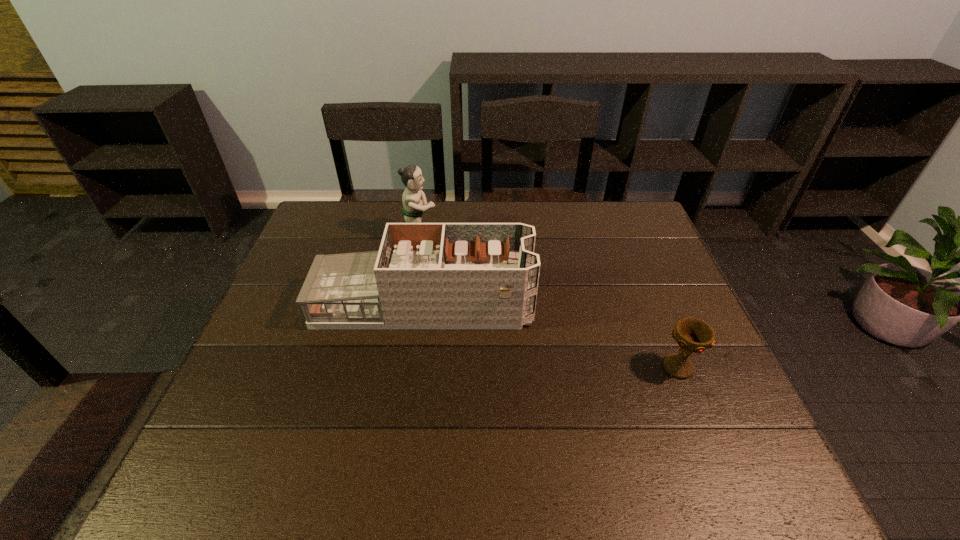
This screenshot has height=540, width=960. In order to click on the farthest object in this screenshot , I will do `click(413, 207)`.

Identify the location of figurine. (413, 207).

In order to click on dollhouse in this screenshot , I will do click(x=425, y=275).

Identify the location of the second shortest object. (425, 275).

This screenshot has width=960, height=540. What are the coordinates of `the nearest object` in the screenshot? It's located at (693, 335).

Locate an element on the screen. the rightmost object is located at coordinates click(x=693, y=335).

What are the coordinates of `free space located 0.250m on the front-facing side of the farthest object` in the screenshot? It's located at (516, 236).

I want to click on free location located 0.250m at the entrance of the dollhouse, so [x=625, y=305].

At what (x,y) coordinates should I click in order to perform the action: click on free space located on the left of the chalice. Please return your answer as a coordinate pair (x, y). The image size is (960, 540). Looking at the image, I should click on (510, 368).

The image size is (960, 540). Identify the location of object located at the far edge. (413, 207).